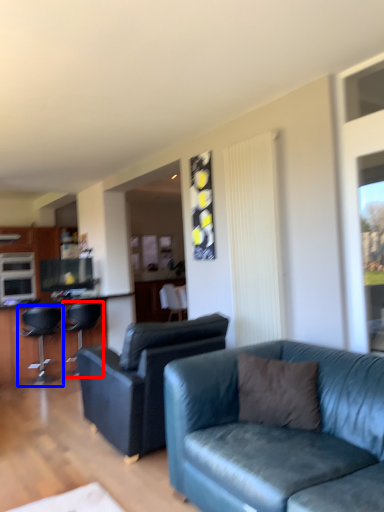
Question: Which point is closer to the camera, chair (highlighted by a red box) or chair (highlighted by a blue box)?

Choices:
 (A) chair
 (B) chair

Answer: (B)